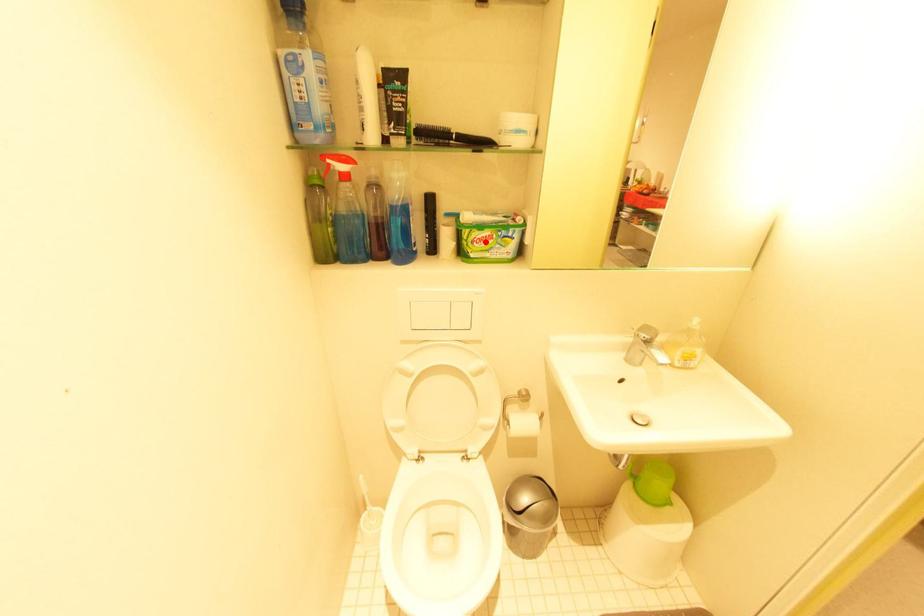
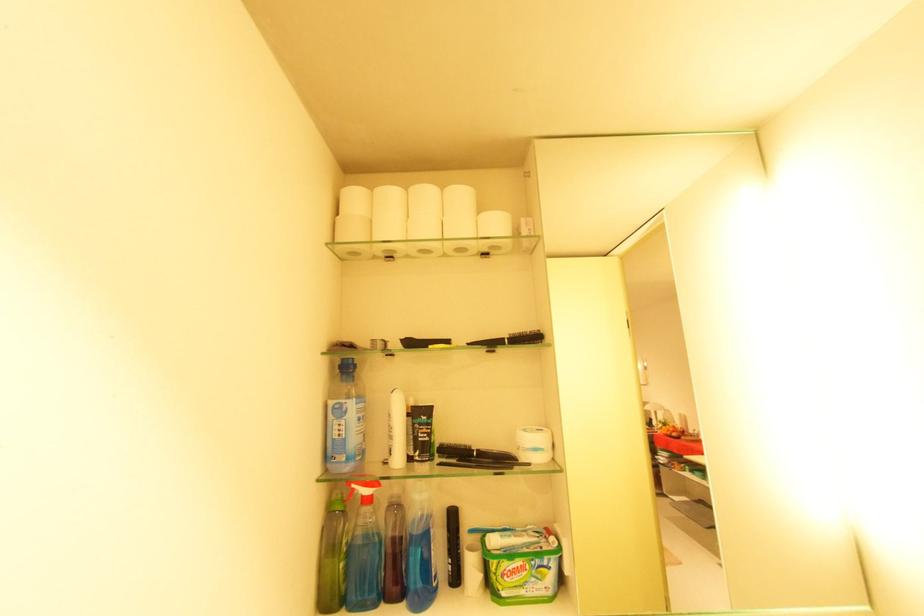
Find the pixel in the second image that matches the highlighted location in the first image.

(517, 573)